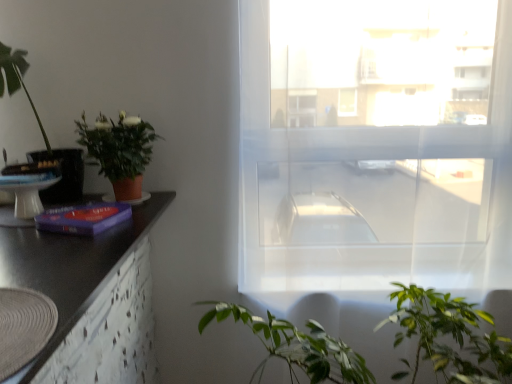
Question: From a real-world perspective, is white glossy round table at left above or below black matte counter top at left?

Choices:
 (A) above
 (B) below

Answer: (A)

Question: From the image's perspective, is white glossy round table at left positioned above or below black matte counter top at left?

Choices:
 (A) below
 (B) above

Answer: (B)

Question: Which object is the closest to the matte terracotta pot at left, the 1th houseplant positioned from the right?

Choices:
 (A) black matte counter top at left
 (B) green leafy plant at left, the second houseplant positioned from the right
 (C) transparent fabric window at center
 (D) green leafy plant at lower center
 (E) purple matte book at left

Answer: (B)

Question: Estimate the real-world distances between objects in this image. Which object is closer to the green leafy plant at left, the second houseplant positioned from the right?

Choices:
 (A) purple matte book at left
 (B) transparent fabric window at center
 (C) matte terracotta pot at left, the 1th houseplant positioned from the right
 (D) green leafy plant at lower center
 (E) white glossy round table at left

Answer: (C)